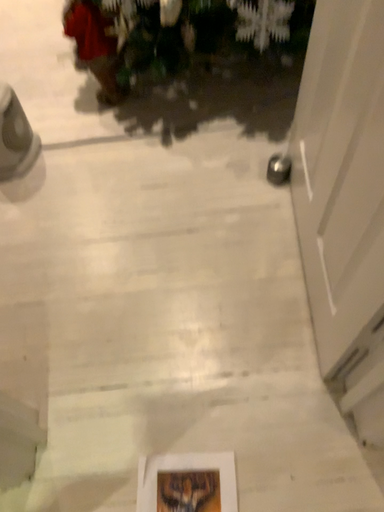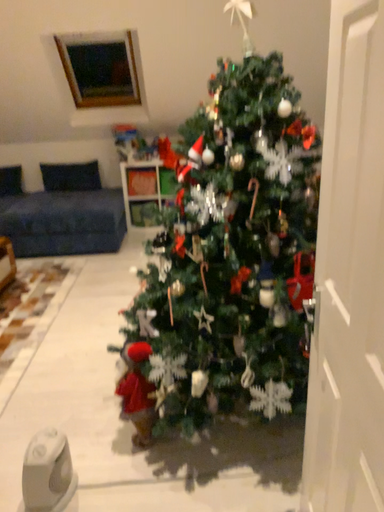
Question: Which way did the camera rotate in the video?

Choices:
 (A) rotated upward
 (B) rotated downward

Answer: (A)